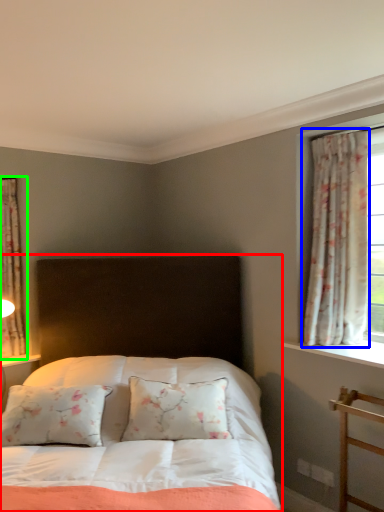
Question: Estimate the real-world distances between objects in this image. Which object is closer to bed (highlighted by a red box), curtain (highlighted by a blue box) or curtain (highlighted by a green box)?

Choices:
 (A) curtain
 (B) curtain

Answer: (A)